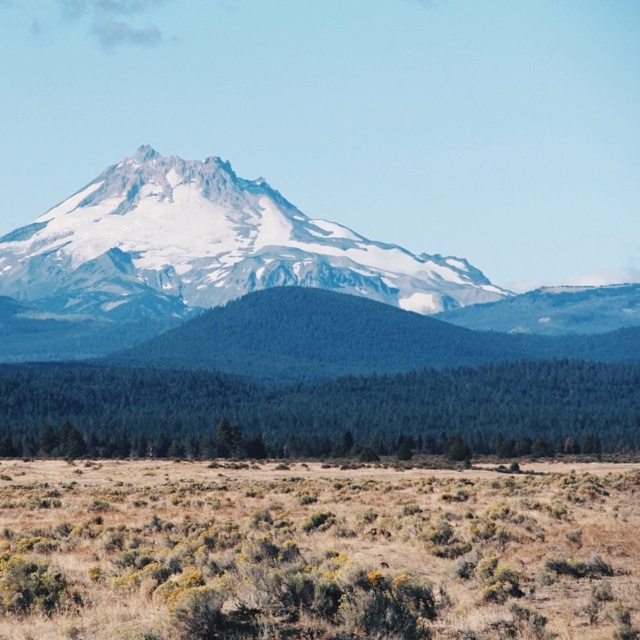
Question: Which point is farther from the camera taking this photo?

Choices:
 (A) (230, 579)
 (B) (186, 296)

Answer: (B)

Question: Which of the following is the farthest from the observer?

Choices:
 (A) (435, 518)
 (B) (195, 269)

Answer: (B)

Question: Among these points, which one is farthest from the camera?

Choices:
 (A) (403, 298)
 (B) (118, 499)

Answer: (A)

Question: Is dry shrubbery at lower left to the right of white snow-covered mountain at center from the viewer's perspective?

Choices:
 (A) no
 (B) yes

Answer: (B)

Question: Does dry shrubbery at lower left appear on the left side of white snow-covered mountain at center?

Choices:
 (A) no
 (B) yes

Answer: (A)

Question: Is dry shrubbery at lower left thinner than white snow-covered mountain at center?

Choices:
 (A) no
 (B) yes

Answer: (B)